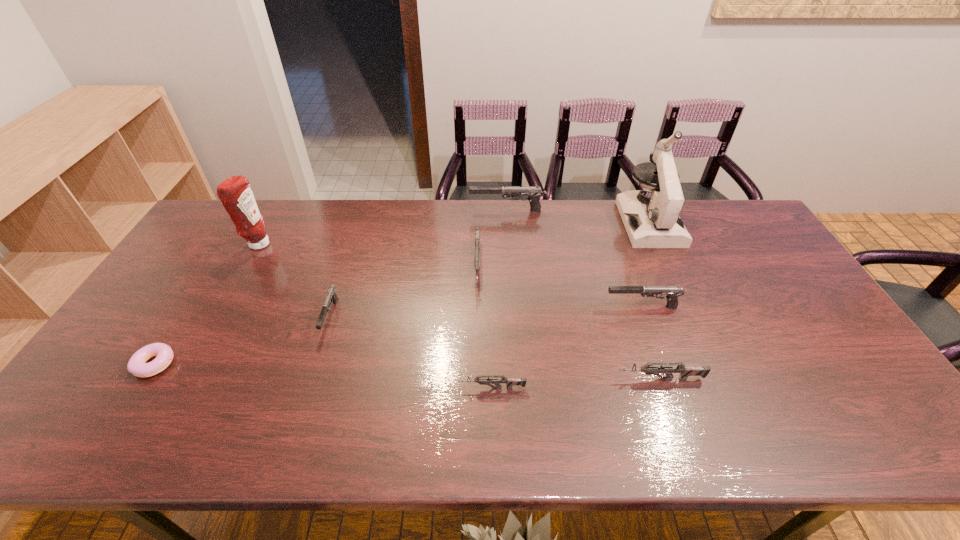
In order to click on free region located 0.060m aimed along the barrel of the farthest grey gun in this screenshot , I will do `click(477, 314)`.

Identify the location of vacant space located 0.090m at the muzzle end of the second smallest gray gun. (573, 307).

Identify the location of free location located at the muzzle end of the second smallest gray gun. (468, 307).

Locate an element on the screen. free space located 0.320m at the muzzle end of the second smallest gray gun is located at coordinates (492, 307).

Locate an element on the screen. This screenshot has height=540, width=960. vacant space located 0.370m aimed along the barrel of the second farthest grey gun is located at coordinates (467, 379).

The height and width of the screenshot is (540, 960). I want to click on vacant position located 0.300m aimed along the barrel of the second farthest grey gun, so click(x=495, y=379).

Identify the location of blank space located 0.210m aimed along the barrel of the second farthest grey gun. The width and height of the screenshot is (960, 540). (532, 379).

Image resolution: width=960 pixels, height=540 pixels. I want to click on vacant point located 0.240m at the muzzle end of the leftmost gray gun, so click(297, 424).

Locate an element on the screen. Image resolution: width=960 pixels, height=540 pixels. vacant region located aimed along the barrel of the nearest grey gun is located at coordinates (414, 388).

Find the location of `vacant space located aimed along the barrel of the nearest grey gun`. vacant space located aimed along the barrel of the nearest grey gun is located at coordinates (327, 388).